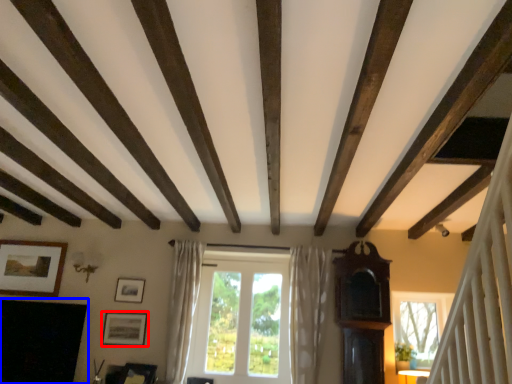
Question: Among these objects, which one is farthest to the camera, picture frame (highlighted by a red box) or fireplace (highlighted by a blue box)?

Choices:
 (A) picture frame
 (B) fireplace

Answer: (A)